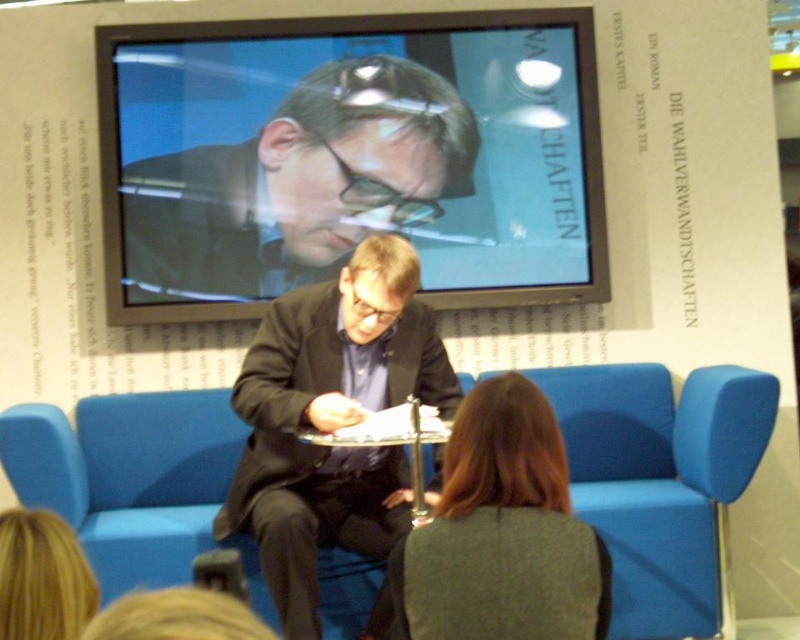
Does dark brown suit at center have a smaller size compared to dark brown hair at center?

Actually, dark brown suit at center might be larger than dark brown hair at center.

Can you confirm if dark brown suit at center is bigger than dark brown hair at center?

Indeed, dark brown suit at center has a larger size compared to dark brown hair at center.

Who is more distant from viewer, (x=416, y=390) or (x=517, y=614)?

The point (x=416, y=390) is more distant.

Find the location of a particular element. The height and width of the screenshot is (640, 800). dark brown suit at center is located at coordinates (332, 420).

Is point (254, 461) behind point (0, 525)?

Yes, it is behind point (0, 525).

Which is more to the right, dark brown suit at center or blonde hair at lower left?

Positioned to the right is dark brown suit at center.

Which is in front, point (280, 321) or point (52, 589)?

Point (52, 589) is more forward.

Locate an element on the screen. The height and width of the screenshot is (640, 800). dark brown suit at center is located at coordinates (332, 420).

Does matte black screen at upper center have a larger size compared to dark brown hair at center?

Correct, matte black screen at upper center is larger in size than dark brown hair at center.

In order to click on matte black screen at upper center in this screenshot , I will do `click(350, 157)`.